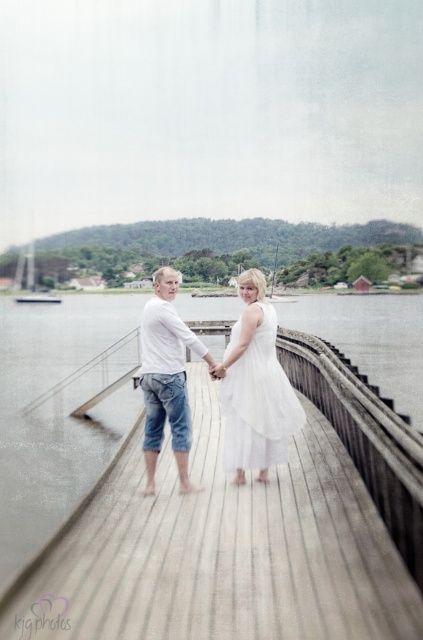
Does white cotton dress at center come behind white cotton shirt at center?

No, white cotton dress at center is closer to the viewer.

Who is higher up, white cotton dress at center or white cotton shirt at center?

white cotton dress at center is above.

You are a GUI agent. You are given a task and a screenshot of the screen. Output one action in this format:
    pyautogui.click(x=<x>, y=<y>)
    Task: Click on the white cotton dress at center
    
    Given the screenshot: What is the action you would take?
    pyautogui.click(x=184, y=376)

Is wooden at center closer to camera compared to white cotton shirt at center?

Yes.

Who is positioned more to the left, wooden at center or white cotton shirt at center?

Positioned to the left is white cotton shirt at center.

Is point (208, 532) positioned in front of point (167, 310)?

Yes, point (208, 532) is closer to viewer.

The height and width of the screenshot is (640, 423). Find the location of `wooden at center`. wooden at center is located at coordinates (246, 531).

The width and height of the screenshot is (423, 640). I want to click on wooden at center, so click(x=246, y=531).

Does wooden at center appear over white sheer dress at center?

Actually, wooden at center is below white sheer dress at center.

The height and width of the screenshot is (640, 423). What are the coordinates of `wooden at center` in the screenshot? It's located at (246, 531).